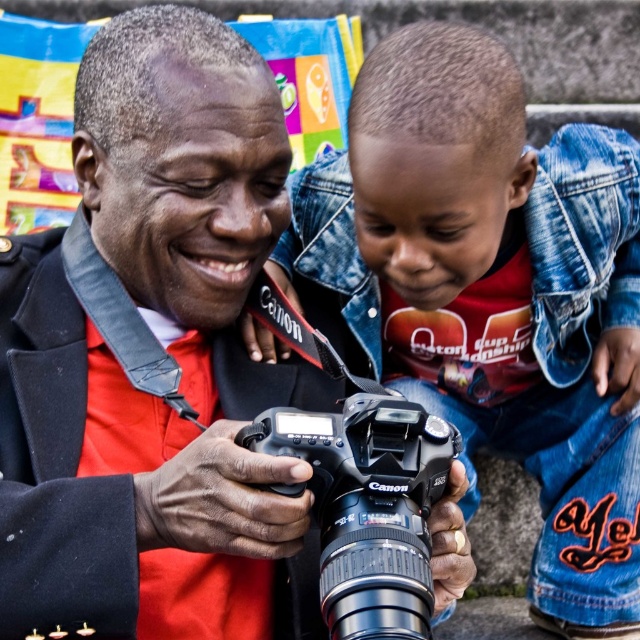
Looking at this image, does black matte camera at center have a lesser width compared to denim jacket at center?

Yes.

Locate an element on the screen. This screenshot has height=640, width=640. black matte camera at center is located at coordinates (154, 356).

This screenshot has width=640, height=640. What are the coordinates of `black matte camera at center` in the screenshot? It's located at (154, 356).

Who is more distant from viewer, (598, 604) or (408, 634)?

The point (598, 604) is behind.

Who is higher up, denim jacket at center or black plastic camera at center?

Positioned higher is denim jacket at center.

Identify the location of denim jacket at center. This screenshot has width=640, height=640. (493, 292).

Can you confirm if black matte camera at center is positioned to the left of black plastic camera at center?

Indeed, black matte camera at center is positioned on the left side of black plastic camera at center.

Between black matte camera at center and black plastic camera at center, which one is positioned higher?

black matte camera at center is higher up.

Does point (38, 400) come farther from viewer compared to point (397, 630)?

Yes, it is behind point (397, 630).

Locate an element on the screen. This screenshot has width=640, height=640. black matte camera at center is located at coordinates (154, 356).